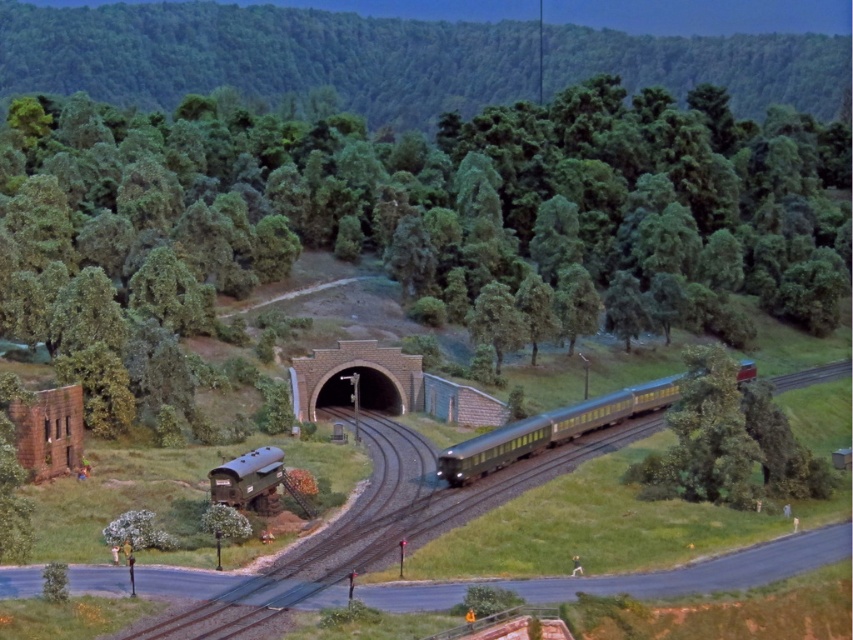
Is green matte tree at center positioned at the back of metallic green train at center?

Yes, green matte tree at center is further from the viewer.

What do you see at coordinates (440, 208) in the screenshot?
I see `green matte tree at center` at bounding box center [440, 208].

Image resolution: width=853 pixels, height=640 pixels. In order to click on green matte tree at center in this screenshot , I will do `click(440, 208)`.

Can you confirm if green matte tree at center is positioned below metallic blue tank car at lower left?

Actually, green matte tree at center is above metallic blue tank car at lower left.

Where is `green matte tree at center`? This screenshot has height=640, width=853. green matte tree at center is located at coordinates (440, 208).

Who is shorter, metallic green train at center or metallic blue tank car at lower left?

metallic blue tank car at lower left is shorter.

Between point (442, 474) and point (271, 465), which one is positioned in front?

Positioned in front is point (271, 465).

Does point (485, 445) come closer to viewer compared to point (224, 500)?

No, (485, 445) is further to viewer.

Locate an element on the screen. The image size is (853, 640). metallic green train at center is located at coordinates (550, 429).